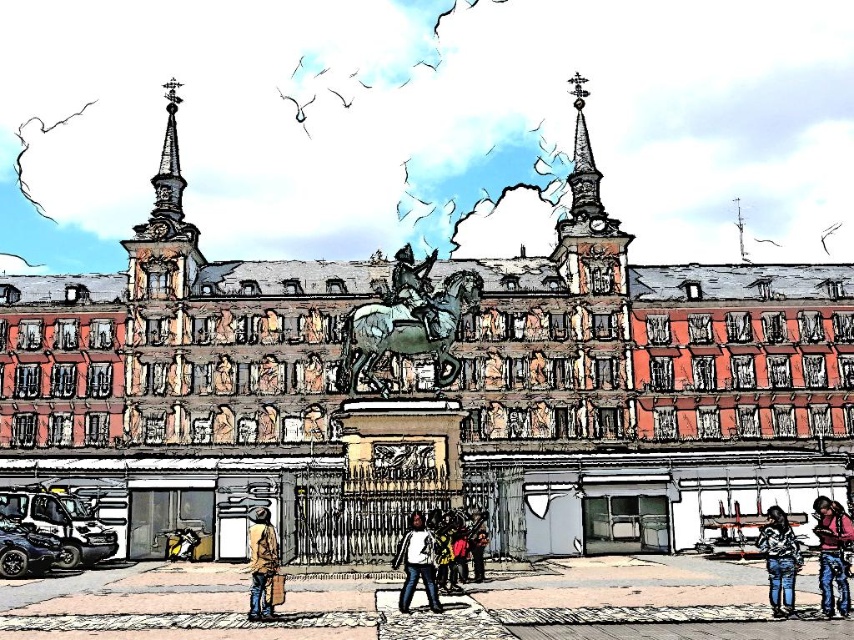
Can you confirm if pink fabric jacket at lower right is thinner than white matte shirt at center?

No, pink fabric jacket at lower right is not thinner than white matte shirt at center.

Does pink fabric jacket at lower right come behind white matte shirt at center?

Yes, it is behind white matte shirt at center.

Who is more distant from viewer, (831, 612) or (419, 572)?

Point (419, 572)

I want to click on pink fabric jacket at lower right, so click(x=832, y=554).

Is pink fabric jacket at lower right to the left of brown leather jacket at lower center from the viewer's perspective?

No, pink fabric jacket at lower right is not to the left of brown leather jacket at lower center.

Is pink fabric jacket at lower right to the right of brown leather jacket at lower center from the viewer's perspective?

Correct, you'll find pink fabric jacket at lower right to the right of brown leather jacket at lower center.

Who is more distant from viewer, (832, 532) or (252, 611)?

Positioned behind is point (832, 532).

Locate an element on the screen. The image size is (854, 640). pink fabric jacket at lower right is located at coordinates (832, 554).

Which is more to the right, denim jacket at lower right or white matte shirt at center?

Positioned to the right is denim jacket at lower right.

Based on the photo, does denim jacket at lower right appear on the left side of white matte shirt at center?

Incorrect, denim jacket at lower right is not on the left side of white matte shirt at center.

In order to click on denim jacket at lower right in this screenshot , I will do click(779, 561).

At what (x,y) coordinates should I click in order to perform the action: click on denim jacket at lower right. Please return your answer as a coordinate pair (x, y). Image resolution: width=854 pixels, height=640 pixels. Looking at the image, I should click on (779, 561).